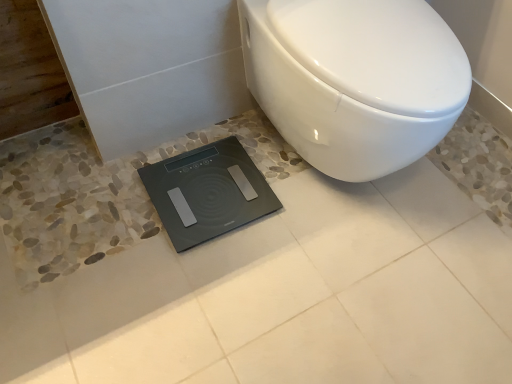
Question: Does white glossy toilet at center touch black glass scale at lower center?

Choices:
 (A) yes
 (B) no

Answer: (B)

Question: Is white glossy toilet at center positioned with its back to black glass scale at lower center?

Choices:
 (A) yes
 (B) no

Answer: (B)

Question: Does white glossy toilet at center have a greater width compared to black glass scale at lower center?

Choices:
 (A) yes
 (B) no

Answer: (A)

Question: From the image's perspective, is white glossy toilet at center below black glass scale at lower center?

Choices:
 (A) yes
 (B) no

Answer: (B)

Question: From a real-world perspective, is white glossy toilet at center below black glass scale at lower center?

Choices:
 (A) no
 (B) yes

Answer: (A)

Question: Is white glossy toilet at center closer to camera compared to black glass scale at lower center?

Choices:
 (A) yes
 (B) no

Answer: (A)

Question: Is black glass scale at lower center not inside white glossy toilet at center?

Choices:
 (A) yes
 (B) no

Answer: (A)

Question: Is black glass scale at lower center next to white glossy toilet at center and touching it?

Choices:
 (A) yes
 (B) no

Answer: (B)

Question: Does black glass scale at lower center have a lesser width compared to white glossy toilet at center?

Choices:
 (A) no
 (B) yes

Answer: (B)

Question: Can you confirm if black glass scale at lower center is shorter than white glossy toilet at center?

Choices:
 (A) no
 (B) yes

Answer: (B)

Question: From the image's perspective, does black glass scale at lower center appear higher than white glossy toilet at center?

Choices:
 (A) yes
 (B) no

Answer: (B)

Question: From the image's perspective, is black glass scale at lower center under white glossy toilet at center?

Choices:
 (A) no
 (B) yes

Answer: (B)

Question: From a real-world perspective, relative to black glass scale at lower center, is white glossy toilet at center vertically above or below?

Choices:
 (A) above
 (B) below

Answer: (A)